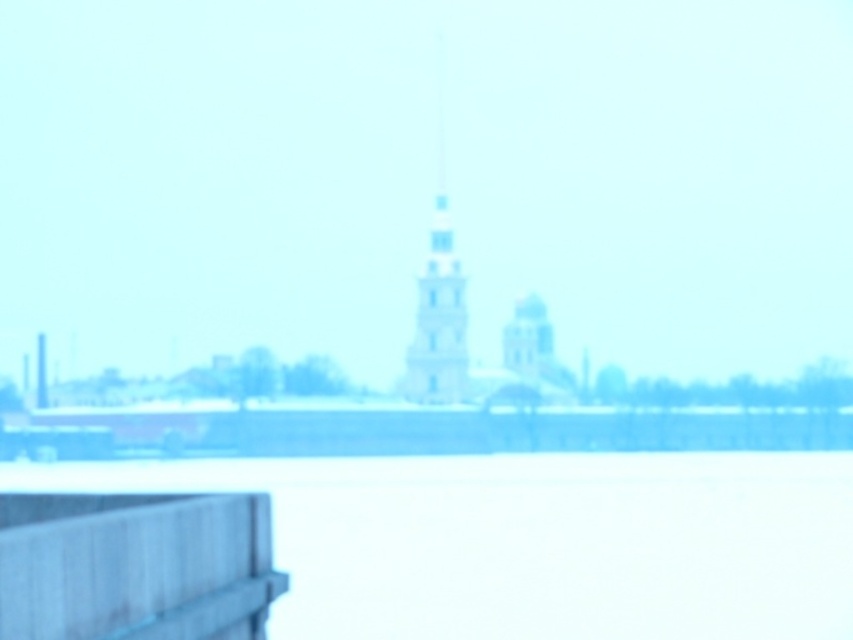
Question: Can you confirm if gray wood rail at lower left is smaller than white stone tower at center?

Choices:
 (A) no
 (B) yes

Answer: (B)

Question: Among these objects, which one is farthest from the camera?

Choices:
 (A) white stone tower at center
 (B) white matte water at lower center

Answer: (A)

Question: Is white matte water at lower center thinner than gray wood rail at lower left?

Choices:
 (A) no
 (B) yes

Answer: (A)

Question: Which of the following is the farthest from the observer?

Choices:
 (A) (846, 490)
 (B) (431, 248)
 (C) (108, 520)

Answer: (B)

Question: Is white matte water at lower center below gray wood rail at lower left?

Choices:
 (A) no
 (B) yes

Answer: (B)

Question: Which point is closer to the camera?

Choices:
 (A) (61, 477)
 (B) (451, 364)

Answer: (A)